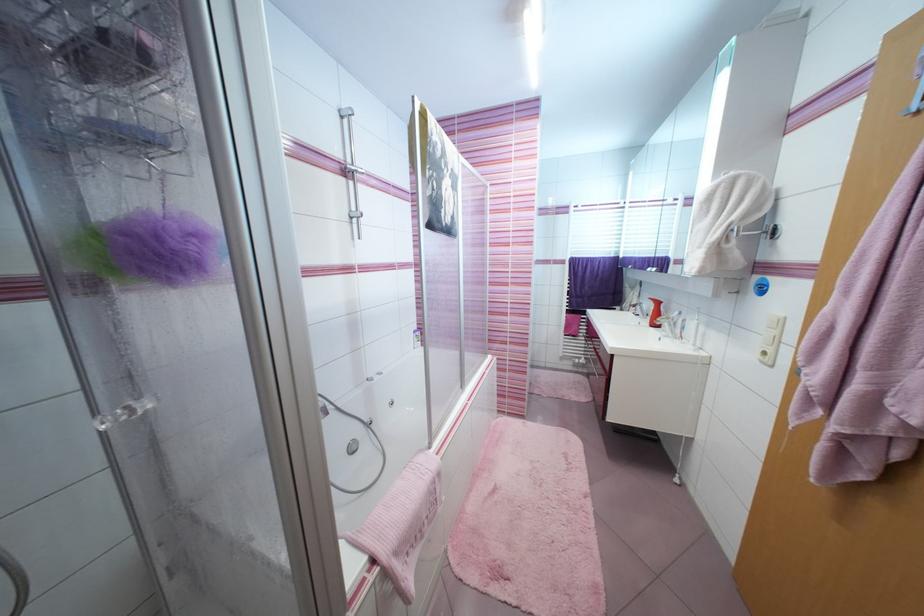
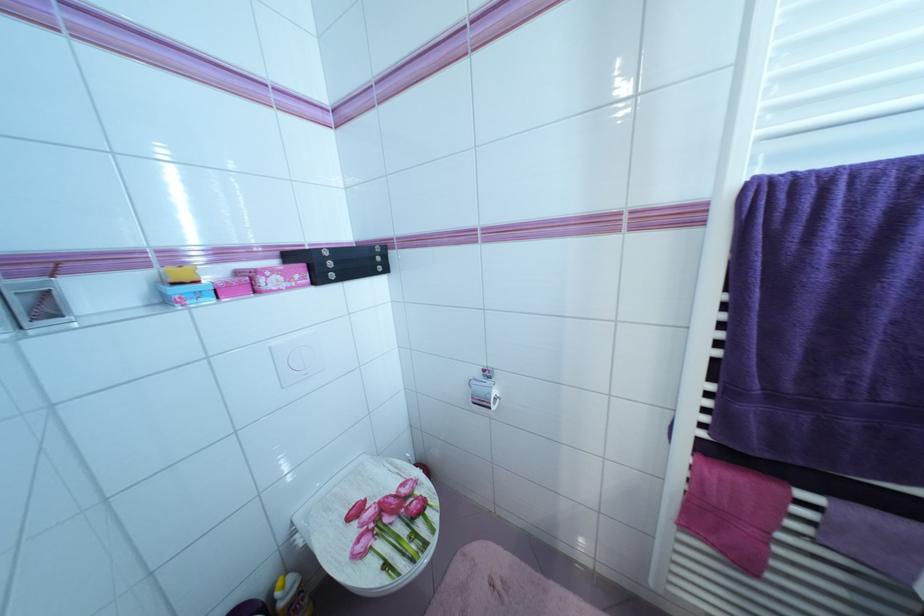
Which direction would the cameraman need to move to produce the second image?

The movement direction of the cameraman is right, forward.